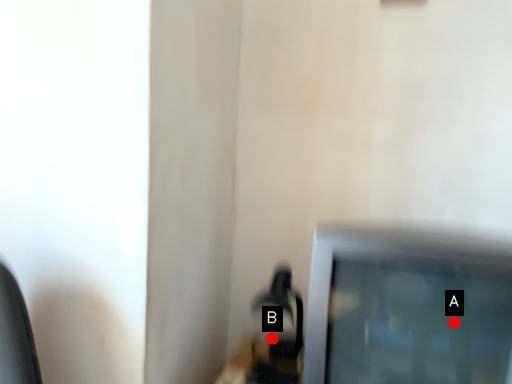
Question: Two points are circled on the image, labeled by A and B beside each circle. Which point appears farthest from the camera in this image?

Choices:
 (A) A is further
 (B) B is further

Answer: (B)